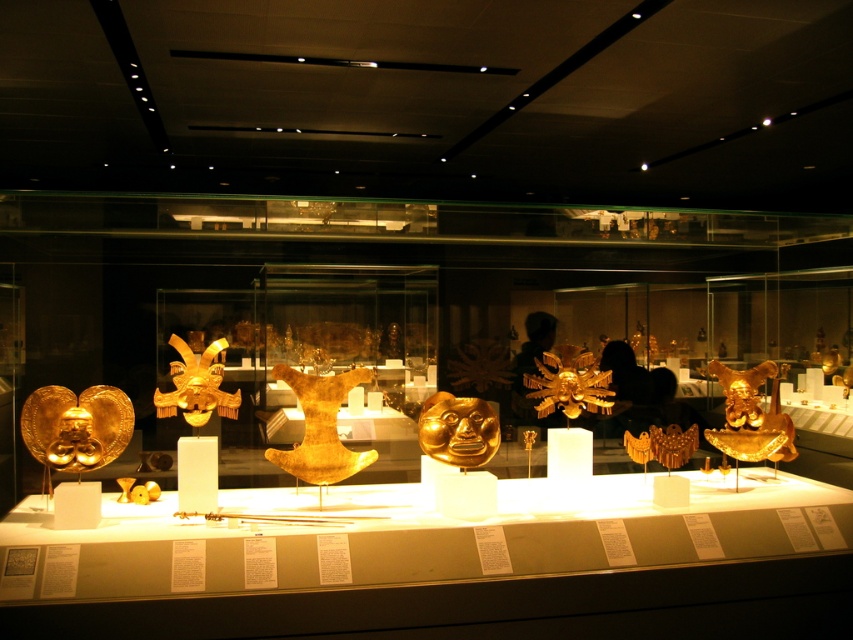
Is gold shiny mask at right above gold/metallic mask at center?

Incorrect, gold shiny mask at right is not positioned above gold/metallic mask at center.

Does gold shiny mask at right appear on the right side of gold/metallic mask at center?

Yes, gold shiny mask at right is to the right of gold/metallic mask at center.

Does point (772, 442) come closer to viewer compared to point (213, 353)?

No, (772, 442) is further to viewer.

Find the location of a particular element. Image resolution: width=853 pixels, height=640 pixels. gold shiny mask at right is located at coordinates (751, 417).

Can you confirm if gold shiny mask at right is smaller than gold shiny mask at center?

Actually, gold shiny mask at right might be larger than gold shiny mask at center.

Can you confirm if gold shiny mask at right is taller than gold shiny mask at center?

Indeed, gold shiny mask at right has a greater height compared to gold shiny mask at center.

The width and height of the screenshot is (853, 640). I want to click on gold shiny mask at right, so click(x=751, y=417).

Is point (294, 465) positioned in front of point (416, 433)?

Yes, point (294, 465) is closer to viewer.

Between gold/golden mask at center and gold shiny mask at center, which one is positioned lower?

→ Positioned lower is gold shiny mask at center.

Locate an element on the screen. This screenshot has width=853, height=640. gold/golden mask at center is located at coordinates (320, 428).

Find the location of a particular element. gold/golden mask at center is located at coordinates (320, 428).